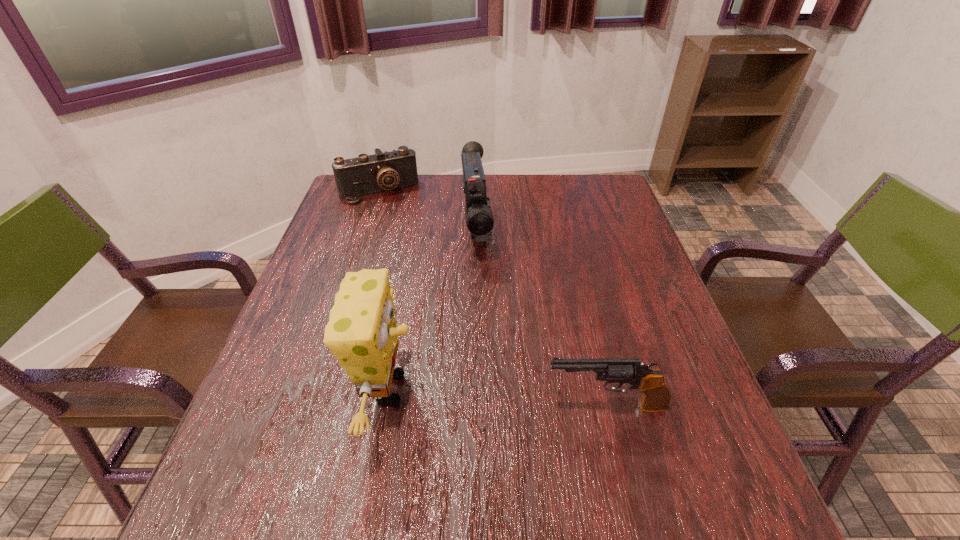
Locate an element on the screen. This screenshot has width=960, height=540. vacant area between the gun and the shortest object is located at coordinates (492, 299).

Locate an element on the screen. The height and width of the screenshot is (540, 960). vacant space that's between the second tallest object and the camera is located at coordinates (427, 211).

Find the location of a particular element. The image size is (960, 540). free spot between the shortest object and the gun is located at coordinates coord(492,299).

The image size is (960, 540). Find the location of `vacant area that lies between the sponge and the rightmost object`. vacant area that lies between the sponge and the rightmost object is located at coordinates (497, 398).

This screenshot has width=960, height=540. In order to click on unoccupied position between the camcorder and the sponge in this screenshot , I will do (432, 309).

At what (x,y) coordinates should I click in order to perform the action: click on empty space that is in between the second tallest object and the gun. Please return your answer as a coordinate pair (x, y). The image size is (960, 540). Looking at the image, I should click on (541, 318).

Locate an element on the screen. Image resolution: width=960 pixels, height=540 pixels. object that stands as the third closest to the sponge is located at coordinates (367, 174).

This screenshot has width=960, height=540. Identify the location of object that ranks as the second closest to the second tallest object. (361, 332).

Identify the location of free space that satisfies the following two spatial constraints: 1. on the front side of the sponge; 2. on the face of the shortest object. This screenshot has height=540, width=960. (314, 389).

Image resolution: width=960 pixels, height=540 pixels. Find the location of `vacant space that satisfies the following two spatial constraints: 1. on the front side of the gun; 2. along the barrel of the camera`. vacant space that satisfies the following two spatial constraints: 1. on the front side of the gun; 2. along the barrel of the camera is located at coordinates (309, 406).